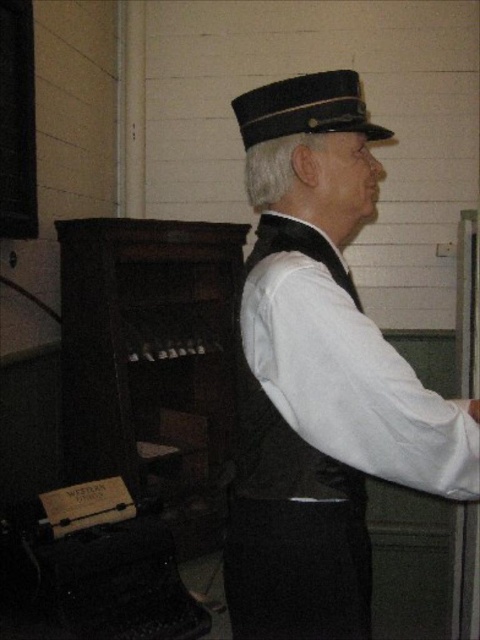
Question: Which object appears farthest from the camera in this image?

Choices:
 (A) black matte uniform at center
 (B) black felt hat at upper center

Answer: (B)

Question: Where is black matte uniform at center located in relation to black felt hat at upper center in the image?

Choices:
 (A) above
 (B) below

Answer: (B)

Question: Is black matte uniform at center thinner than black felt hat at upper center?

Choices:
 (A) yes
 (B) no

Answer: (B)

Question: Observing the image, what is the correct spatial positioning of black matte uniform at center in reference to black felt hat at upper center?

Choices:
 (A) below
 (B) above

Answer: (A)

Question: Among these points, which one is farthest from the camera?

Choices:
 (A) (266, 291)
 (B) (302, 125)

Answer: (B)